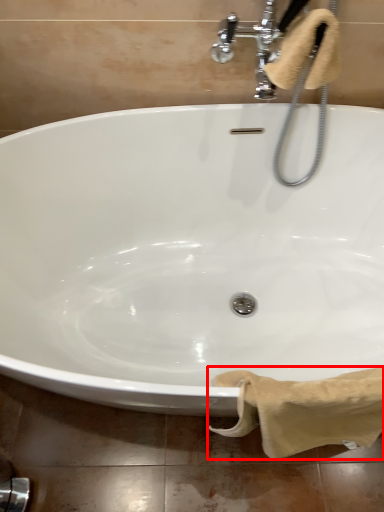
Question: From the image's perspective, what is the correct spatial positioning of bath towel (annotated by the red box) in reference to bath towel?

Choices:
 (A) above
 (B) below

Answer: (B)